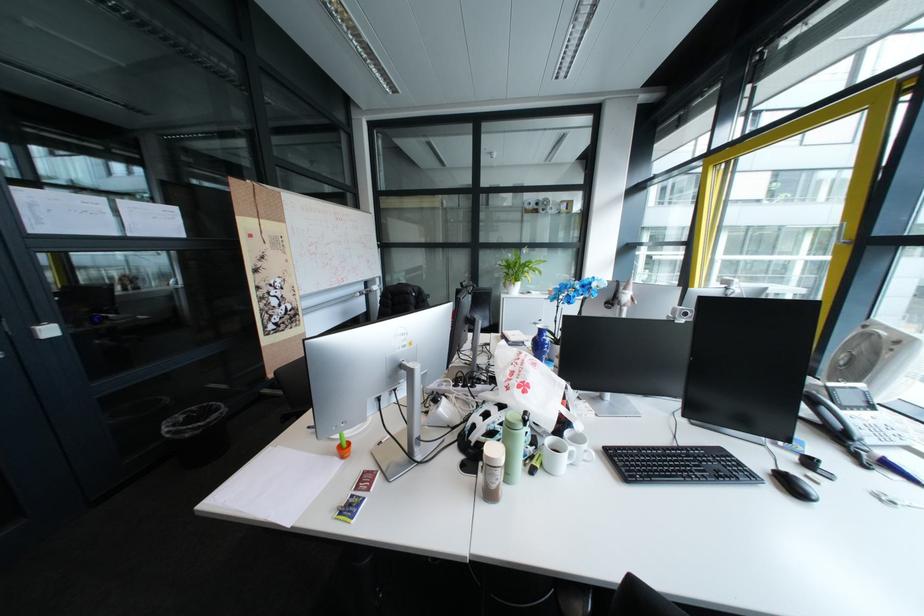
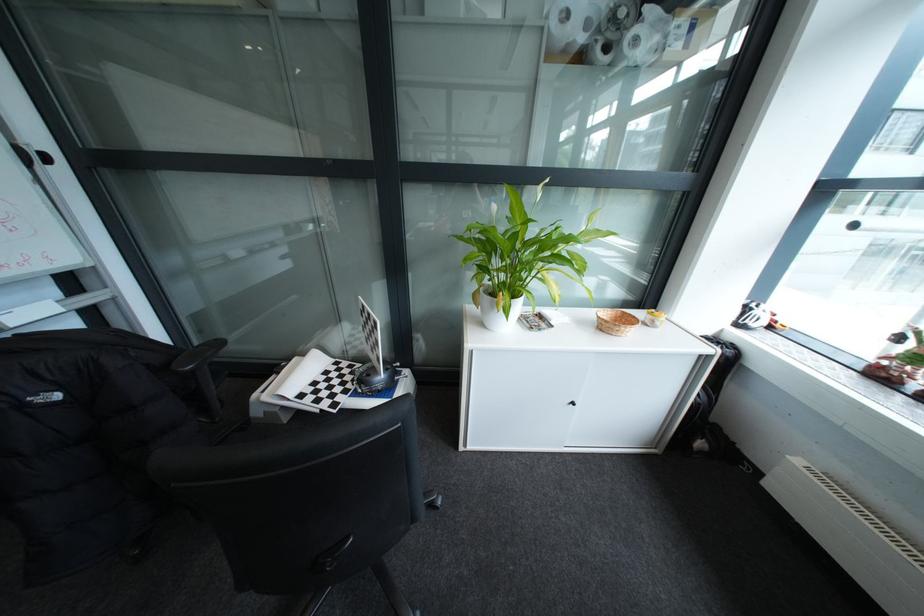
The point at (x=528, y=281) is marked in the first image. Where is the corresponding point in the second image?

(521, 299)